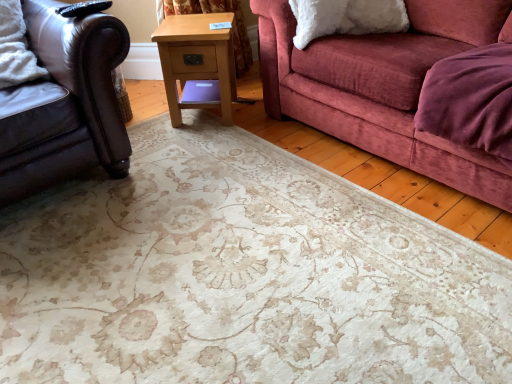
Find the location of a particular element. The height and width of the screenshot is (384, 512). leather couch at left is located at coordinates (67, 104).

What is the approximate height of leather couch at left?

leather couch at left is 30.18 inches tall.

What do you see at coordinates (67, 104) in the screenshot?
I see `leather couch at left` at bounding box center [67, 104].

This screenshot has height=384, width=512. What do you see at coordinates (197, 63) in the screenshot?
I see `light wood/texture side table at center` at bounding box center [197, 63].

Measure the distance between point (231,103) and camera.

They are 2.21 meters apart.

Where is `light wood/texture side table at center`? This screenshot has height=384, width=512. light wood/texture side table at center is located at coordinates (197, 63).

Image resolution: width=512 pixels, height=384 pixels. In order to click on leather couch at left in this screenshot , I will do `click(67, 104)`.

Which is more to the right, leather couch at left or light wood/texture side table at center?

light wood/texture side table at center.

Which object is closer to the camera taking this photo, leather couch at left or light wood/texture side table at center?

leather couch at left.

Does point (55, 52) come closer to viewer compared to point (213, 57)?

Yes, point (55, 52) is in front of point (213, 57).

From the image's perspective, relative to light wood/texture side table at center, is leather couch at left above or below?

From the image's perspective, leather couch at left appears below light wood/texture side table at center.

From a real-world perspective, is leather couch at left physically below light wood/texture side table at center?

Actually, leather couch at left is physically above light wood/texture side table at center in the real world.

Which object is wider, leather couch at left or light wood/texture side table at center?

leather couch at left is wider.

From their relative heights in the image, would you say leather couch at left is taller or shorter than light wood/texture side table at center?

leather couch at left is taller than light wood/texture side table at center.

Which of these two, leather couch at left or light wood/texture side table at center, is bigger?

leather couch at left is bigger.

Do you think leather couch at left is within light wood/texture side table at center, or outside of it?

leather couch at left lies outside light wood/texture side table at center.

Is leather couch at left far from light wood/texture side table at center?

No.

Is leather couch at left facing towards light wood/texture side table at center?

No, leather couch at left is not aimed at light wood/texture side table at center.

In the scene shown: Measure the distance from leather couch at left to light wood/texture side table at center.

A distance of 21.22 inches exists between leather couch at left and light wood/texture side table at center.

The image size is (512, 384). In the image, there is a light wood/texture side table at center. Identify the location of studio couch below it (from the image's perspective). coord(67,104).

Does light wood/texture side table at center appear on the left side of leather couch at left?

No, light wood/texture side table at center is not to the left of leather couch at left.

In the image, is light wood/texture side table at center positioned in front of or behind leather couch at left?

In the image, light wood/texture side table at center appears behind leather couch at left.

Considering the points (223, 32) and (114, 23), which point is in front, point (223, 32) or point (114, 23)?

Positioned in front is point (114, 23).

From the image's perspective, which is below, light wood/texture side table at center or leather couch at left?

leather couch at left appears lower in the image.

From a real-world perspective, who is located lower, light wood/texture side table at center or leather couch at left?

light wood/texture side table at center.

Is light wood/texture side table at center thinner than leather couch at left?

Indeed, light wood/texture side table at center has a lesser width compared to leather couch at left.

Who is taller, light wood/texture side table at center or leather couch at left?

leather couch at left is taller.

Between light wood/texture side table at center and leather couch at left, which one has smaller size?

Smaller between the two is light wood/texture side table at center.

Is leather couch at left inside light wood/texture side table at center?

No.

Is light wood/texture side table at center not near leather couch at left?

Actually, light wood/texture side table at center and leather couch at left are a little close together.

Is leather couch at left at the back of light wood/texture side table at center?

light wood/texture side table at center does not have its back to leather couch at left.

Image resolution: width=512 pixels, height=384 pixels. Find the location of `studio couch located on the left of light wood/texture side table at center`. studio couch located on the left of light wood/texture side table at center is located at coordinates (67, 104).

Image resolution: width=512 pixels, height=384 pixels. I want to click on table located above the leather couch at left (from the image's perspective), so click(197, 63).

Identify the location of table to the right of leather couch at left. Image resolution: width=512 pixels, height=384 pixels. (197, 63).